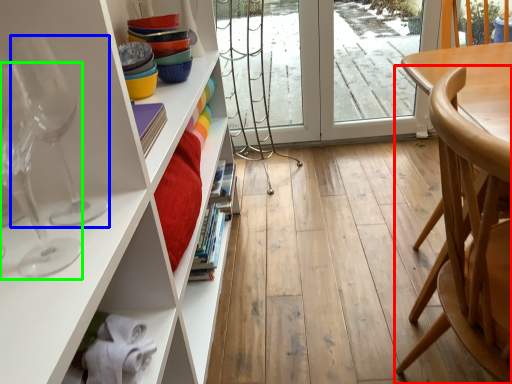
Question: Considering the real-world distances, which object is farthest from chair (highlighted by a red box)? wine glass (highlighted by a blue box) or wine glass (highlighted by a green box)?

Choices:
 (A) wine glass
 (B) wine glass

Answer: (B)